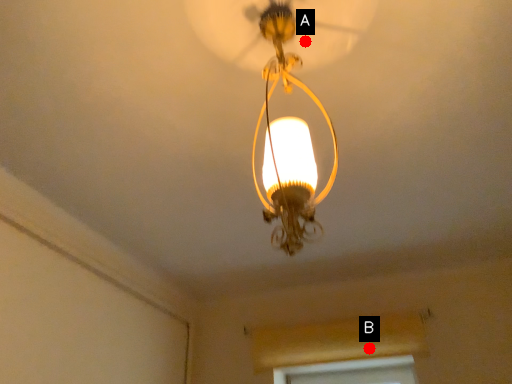
Question: Two points are circled on the image, labeled by A and B beside each circle. Which point is further to the camera?

Choices:
 (A) A is further
 (B) B is further

Answer: (B)